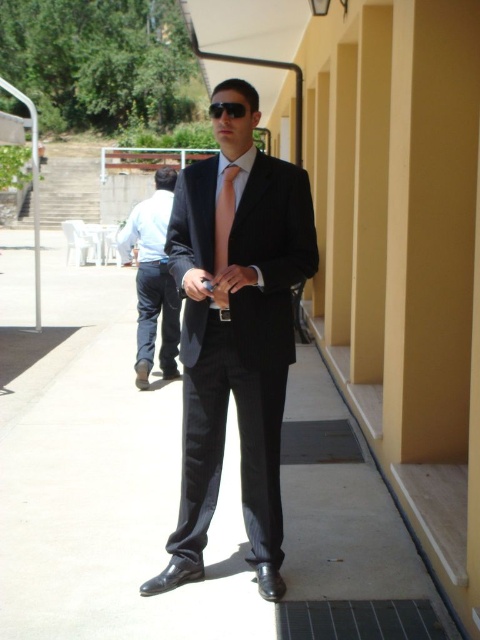
Which is above, black pinstripe suit at center or black plastic goggles at center?

black plastic goggles at center is higher up.

Between black pinstripe suit at center and black plastic goggles at center, which one has less height?

With less height is black pinstripe suit at center.

Who is more distant from viewer, [175,172] or [225,104]?

The point [175,172] is more distant.

Where is `black pinstripe suit at center`? The height and width of the screenshot is (640, 480). black pinstripe suit at center is located at coordinates (154, 280).

Who is taller, shiny black suit at center or black plastic goggles at center?

With more height is black plastic goggles at center.

Does shiny black suit at center have a greater height compared to black plastic goggles at center?

No.

Does point (247, 250) come behind point (228, 108)?

That is True.

Find the location of `shiny black suit at center`. shiny black suit at center is located at coordinates (236, 337).

Does shiny black suit at center have a greater width compared to pink silk tie at center?

Yes, shiny black suit at center is wider than pink silk tie at center.

Which is more to the right, shiny black suit at center or pink silk tie at center?

Positioned to the right is pink silk tie at center.

Where is `shiny black suit at center`? shiny black suit at center is located at coordinates (236, 337).

This screenshot has height=640, width=480. I want to click on shiny black suit at center, so click(236, 337).